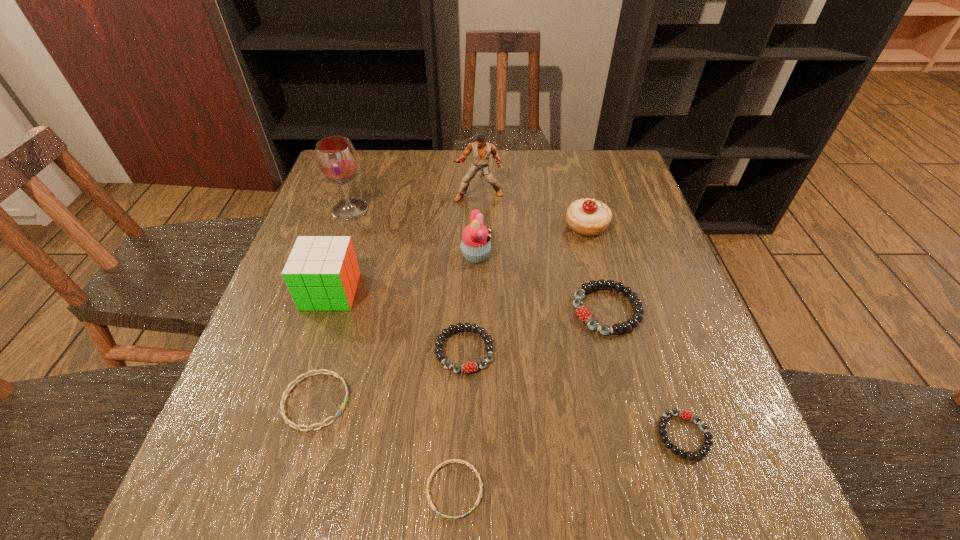
Locate an element on the screen. the farther blue bracelet is located at coordinates (287, 421).

Where is `the leftmost bracelet`? the leftmost bracelet is located at coordinates (287, 421).

What are the coordinates of `the smallest black bracelet` in the screenshot? It's located at (685, 414).

The height and width of the screenshot is (540, 960). Identify the location of the nearer blue bracelet. (453, 460).

You are a GUI agent. You are given a task and a screenshot of the screen. Output one action in this format:
    pyautogui.click(x=<x>, y=<y>)
    Task: Click on the right blue bracelet
    The width and height of the screenshot is (960, 540).
    Given the screenshot: What is the action you would take?
    pyautogui.click(x=453, y=460)

The width and height of the screenshot is (960, 540). In order to click on vacant space located 0.130m on the front of the wineglass in this screenshot , I will do `click(335, 254)`.

Locate an element on the screen. The width and height of the screenshot is (960, 540). free space located on the front-facing side of the puncher is located at coordinates (478, 286).

This screenshot has height=540, width=960. What are the coordinates of `free space located 0.290m on the face of the cupcake` in the screenshot? It's located at (610, 256).

The image size is (960, 540). Identify the location of free space located 0.270m on the back of the cube. (358, 204).

Locate an element on the screen. blank area located on the left of the fifth tallest object is located at coordinates (481, 226).